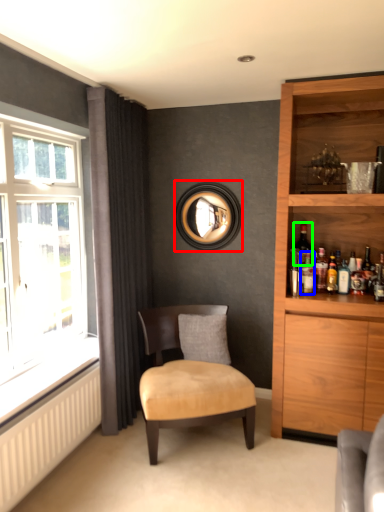
Question: Which object is the farthest from picture frame (highlighted by a red box)? Choose among these: bottle (highlighted by a blue box) or wine bottle (highlighted by a green box).

Choices:
 (A) bottle
 (B) wine bottle

Answer: (B)